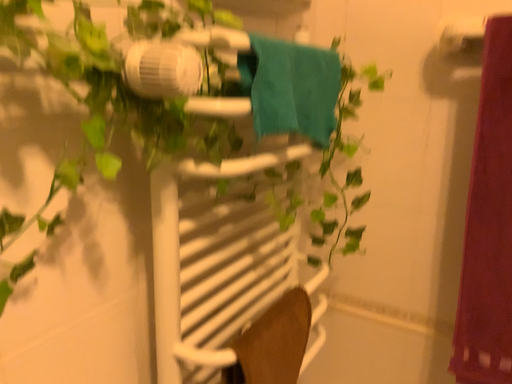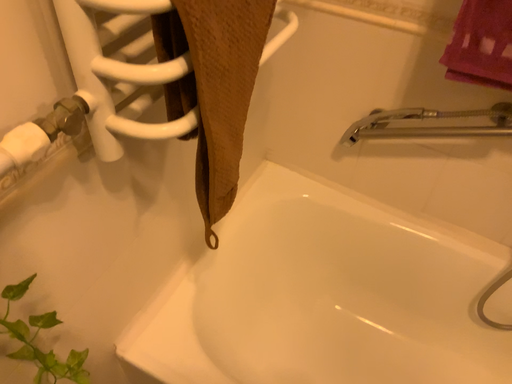
Question: Which way did the camera rotate in the video?

Choices:
 (A) rotated downward
 (B) rotated upward

Answer: (A)